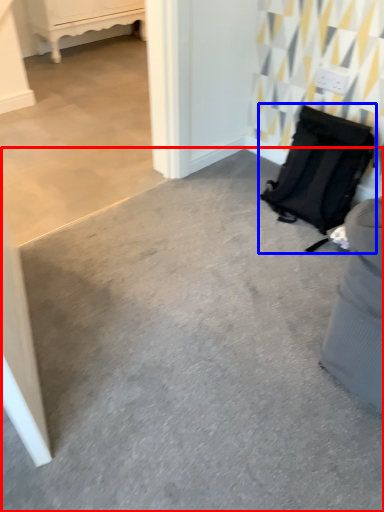
Question: Which of the following is the farthest to the observer, concrete (highlighted by a red box) or luggage and bags (highlighted by a blue box)?

Choices:
 (A) concrete
 (B) luggage and bags

Answer: (B)